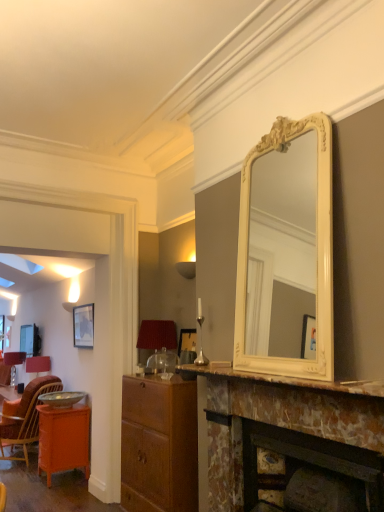
I want to click on wooden cabinet at center, so click(x=159, y=445).

Image resolution: width=384 pixels, height=512 pixels. What do you see at coordinates (83, 326) in the screenshot?
I see `matte black picture frame at upper left` at bounding box center [83, 326].

You are a GUI agent. You are given a task and a screenshot of the screen. Output one action in this format:
    pyautogui.click(x=<x>, y=<y>)
    Task: Click on the marble/marbled fireplace at center
    The height and width of the screenshot is (512, 384).
    Given the screenshot: What is the action you would take?
    pyautogui.click(x=280, y=380)

Does marble fireplace at center have a greater height compared to wooden cabinet at center?

No.

From the image's perspective, is marble fireplace at center over wooden cabinet at center?

Yes, from the image's perspective, marble fireplace at center is on top of wooden cabinet at center.

From the picture: Measure the distance between marble fireplace at center and wooden cabinet at center.

The distance of marble fireplace at center from wooden cabinet at center is 36.03 inches.

Is marble fireplace at center turned away from wooden cabinet at center?

No.

Considering the relative sizes of orange wicker chair at lower left and matte red lampshade at center, the 2th lamp viewed from the back, in the image provided, is orange wicker chair at lower left smaller than matte red lampshade at center, the 2th lamp viewed from the back,?

Actually, orange wicker chair at lower left might be larger than matte red lampshade at center, the 2th lamp viewed from the back.

Is matte red lampshade at center, which is counted as the first lamp, starting from the right, a part of orange wicker chair at lower left?

Definitely not — matte red lampshade at center, which is counted as the first lamp, starting from the right, is not inside orange wicker chair at lower left.

Is orange wicker chair at lower left positioned with its back to matte red lampshade at center, which is counted as the first lamp, starting from the right?

No, orange wicker chair at lower left is not facing the opposite direction of matte red lampshade at center, which is counted as the first lamp, starting from the right.

Is orange wicker chair at lower left far away from matte red lampshade at center, the 2th lamp viewed from the back?

orange wicker chair at lower left is far away from matte red lampshade at center, the 2th lamp viewed from the back.

From a real-world perspective, who is located higher, matte red lampshade at left, the 1th lamp in the left-to-right sequence, or orange glossy cabinet at lower left?

In real-world perspective, matte red lampshade at left, the 1th lamp in the left-to-right sequence, is above.

Between matte red lampshade at left, marked as the second lamp in a top-to-bottom arrangement, and orange glossy cabinet at lower left, which one has less height?

matte red lampshade at left, marked as the second lamp in a top-to-bottom arrangement.

Does matte red lampshade at left, marked as the 1th lamp in a bottom-to-top arrangement, lie in front of orange glossy cabinet at lower left?

No, matte red lampshade at left, marked as the 1th lamp in a bottom-to-top arrangement, is further to the viewer.

Is point (40, 398) positioned before point (245, 382)?

That is False.

Is metallic silver bowl at lower left not close to marble fireplace at center?

metallic silver bowl at lower left is far away from marble fireplace at center.

How many degrees apart are the facing directions of metallic silver bowl at lower left and marble fireplace at center?

There is a 0.0907-degree angle between the facing directions of metallic silver bowl at lower left and marble fireplace at center.

Between metallic silver bowl at lower left and marble fireplace at center, which one appears on the left side from the viewer's perspective?

Positioned to the left is metallic silver bowl at lower left.

Which object is closer to the camera taking this photo, wooden cabinet at center or orange wicker chair at lower left?

wooden cabinet at center is more forward.

Is wooden cabinet at center at the right side of orange wicker chair at lower left?

Yes, wooden cabinet at center is to the right of orange wicker chair at lower left.

From the image's perspective, is wooden cabinet at center below orange wicker chair at lower left?

Actually, wooden cabinet at center appears above orange wicker chair at lower left in the image.

Where is `cabinetry that is above the orange wicker chair at lower left (from a real-world perspective)`? cabinetry that is above the orange wicker chair at lower left (from a real-world perspective) is located at coordinates (159, 445).

How many degrees apart are the facing directions of wooden cabinet at center and matte red lampshade at left, marked as the 1th lamp in a bottom-to-top arrangement?

2.78 degrees separate the facing orientations of wooden cabinet at center and matte red lampshade at left, marked as the 1th lamp in a bottom-to-top arrangement.

Considering the relative sizes of wooden cabinet at center and matte red lampshade at left, marked as the second lamp in a front-to-back arrangement, in the image provided, is wooden cabinet at center smaller than matte red lampshade at left, marked as the second lamp in a front-to-back arrangement,?

No.

In the scene shown: Is wooden cabinet at center looking in the opposite direction of matte red lampshade at left, the first lamp from the back?

wooden cabinet at center does not have its back to matte red lampshade at left, the first lamp from the back.

Which of these two, wooden cabinet at center or matte red lampshade at left, the 1th lamp in the left-to-right sequence, stands shorter?

matte red lampshade at left, the 1th lamp in the left-to-right sequence.

Measure the distance from marble/marbled fireplace at center to matte red lampshade at center, the 2th lamp viewed from the back.

The distance of marble/marbled fireplace at center from matte red lampshade at center, the 2th lamp viewed from the back, is 1.40 meters.

Is marble/marbled fireplace at center bigger than matte red lampshade at center, which is counted as the first lamp, starting from the right?

Actually, marble/marbled fireplace at center might be smaller than matte red lampshade at center, which is counted as the first lamp, starting from the right.

Does marble/marbled fireplace at center lie behind matte red lampshade at center, which is counted as the first lamp, starting from the right?

No.

Is marble/marbled fireplace at center to the left or to the right of matte red lampshade at center, which is counted as the first lamp, starting from the right, in the image?

Based on their positions, marble/marbled fireplace at center is located to the right of matte red lampshade at center, which is counted as the first lamp, starting from the right.

Where is `cabinetry on the left side of marble fireplace at center`? The width and height of the screenshot is (384, 512). cabinetry on the left side of marble fireplace at center is located at coordinates (159, 445).

This screenshot has height=512, width=384. I want to click on chair lying below the matte red lampshade at center, the 2th lamp viewed from the back (from the image's perspective), so click(x=24, y=416).

When comparing their distances from metallic silver bowl at lower left, does orange glossy cabinet at lower left or wooden cabinet at center seem closer?

Based on the image, orange glossy cabinet at lower left appears to be nearer to metallic silver bowl at lower left.

When comparing their distances from orange glossy cabinet at lower left, does marble fireplace at center or wooden cabinet at center seem closer?

The object closer to orange glossy cabinet at lower left is wooden cabinet at center.

Which object lies further to the anchor point wooden cabinet at center, matte black picture frame at upper left or matte red lampshade at left, marked as the second lamp in a front-to-back arrangement?

Among the two, matte red lampshade at left, marked as the second lamp in a front-to-back arrangement, is located further to wooden cabinet at center.

From the picture: From the image, which object appears to be nearer to marble fireplace at center, metallic silver bowl at lower left or marble/marbled fireplace at center?

Based on the image, marble/marbled fireplace at center appears to be nearer to marble fireplace at center.

Based on their spatial positions, is orange glossy cabinet at lower left or wooden cabinet at center further from matte black picture frame at upper left?

wooden cabinet at center lies further to matte black picture frame at upper left than the other object.

Estimate the real-world distances between objects in this image. Which object is closer to marble fireplace at center, matte black picture frame at upper left or metallic silver bowl at lower left?

Among the two, matte black picture frame at upper left is located nearer to marble fireplace at center.

Looking at this image, estimate the real-world distances between objects in this image. Which object is further from orange wicker chair at lower left, matte red lampshade at center, which is counted as the first lamp, starting from the front, or wooden cabinet at center?

wooden cabinet at center is further to orange wicker chair at lower left.

Based on the photo, which object lies nearer to the anchor point matte black picture frame at upper left, marble/marbled fireplace at center or metallic silver bowl at lower left?

Among the two, metallic silver bowl at lower left is located nearer to matte black picture frame at upper left.

I want to click on table between marble/marbled fireplace at center and metallic silver bowl at lower left in the front-back direction, so click(63, 439).

Locate an element on the screen. This screenshot has height=512, width=384. chair between orange glossy cabinet at lower left and matte red lampshade at left, the 2th lamp in the right-to-left sequence, from front to back is located at coordinates (24, 416).

I want to click on round table between marble fireplace at center and matte black picture frame at upper left from front to back, so click(61, 398).

Locate an element on the screen. table located between wooden cabinet at center and orange wicker chair at lower left in the depth direction is located at coordinates (63, 439).